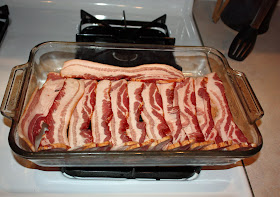
Where is `countertop`? The image size is (280, 197). countertop is located at coordinates (206, 26).